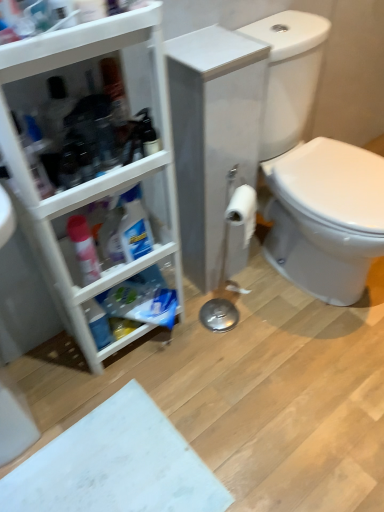
This screenshot has height=512, width=384. What are the coordinates of `translucent plastic spray bottle at left` in the screenshot? It's located at (84, 248).

You are a GUI agent. You are given a task and a screenshot of the screen. Output one action in this format:
    pyautogui.click(x=<x>, y=<y>)
    Task: Click on the white plastic cabinet at left
    
    Given the screenshot: What is the action you would take?
    pyautogui.click(x=93, y=179)

In the scene shown: From the image's perspective, which is below, white plastic cabinet at left or white matte toilet paper at center?

white matte toilet paper at center.

Which object is wider, white plastic cabinet at left or white matte toilet paper at center?

Wider between the two is white plastic cabinet at left.

Considering the sizes of objects white plastic cabinet at left and white matte toilet paper at center in the image provided, who is taller, white plastic cabinet at left or white matte toilet paper at center?

white plastic cabinet at left.

How many degrees apart are the facing directions of white plastic cabinet at left and white matte toilet paper at center?

The angle between the facing direction of white plastic cabinet at left and the facing direction of white matte toilet paper at center is 26.3 degrees.

Find the location of `bathroom cabinet above the white glossy toilet at right (from a real-world perspective)`. bathroom cabinet above the white glossy toilet at right (from a real-world perspective) is located at coordinates (93, 179).

Is white glossy toilet at right positioned far away from white plastic cabinet at left?

That's not correct — white glossy toilet at right is a little close to white plastic cabinet at left.

From the image's perspective, is white glossy toilet at right under white plastic cabinet at left?

No.

Does white glossy toilet at right have a lesser width compared to white plastic cabinet at left?

Incorrect, the width of white glossy toilet at right is not less than that of white plastic cabinet at left.

What are the coordinates of `sit above the white plastic cabinet at left (from the image's perspective)` in the screenshot? It's located at (315, 174).

Which point is more forward, (x=48, y=287) or (x=305, y=61)?

Positioned in front is point (x=48, y=287).

Can you confirm if white plastic cabinet at left is bigger than white glossy toilet at right?

Incorrect, white plastic cabinet at left is not larger than white glossy toilet at right.

Considering the relative positions of white plastic cabinet at left and white glossy toilet at right in the image provided, is white plastic cabinet at left to the left or to the right of white glossy toilet at right?

white plastic cabinet at left is to the left of white glossy toilet at right.

Based on their sizes in the image, would you say translucent plastic spray bottle at left is bigger or smaller than white matte toilet paper at center?

translucent plastic spray bottle at left is smaller than white matte toilet paper at center.

In the image, is translucent plastic spray bottle at left positioned in front of or behind white matte toilet paper at center?

translucent plastic spray bottle at left is in front of white matte toilet paper at center.

Does point (82, 277) appear closer or farther from the camera than point (245, 219)?

Clearly, point (82, 277) is more distant from the camera than point (245, 219).

How much distance is there between translucent plastic spray bottle at left and white matte toilet paper at center?

16.19 inches.

Which object is closer to the camera, white glossy toilet at right or white matte toilet paper at center?

white glossy toilet at right is closer to the camera.

Considering the positions of points (279, 33) and (242, 199), is point (279, 33) closer to camera compared to point (242, 199)?

No, it is not.

Locate an element on the screen. The image size is (384, 512). toilet paper that is behind the white glossy toilet at right is located at coordinates coord(243,211).

Would you say white matte toilet paper at center is part of white glossy toilet at right's contents?

No.

Is translucent plastic spray bottle at left further to camera compared to white glossy toilet at right?

Yes, the depth of translucent plastic spray bottle at left is greater than that of white glossy toilet at right.

Consider the image. Can you confirm if translucent plastic spray bottle at left is positioned to the left of white glossy toilet at right?

Yes, translucent plastic spray bottle at left is to the left of white glossy toilet at right.

Is white glossy toilet at right a part of translucent plastic spray bottle at left?

No, white glossy toilet at right is not surrounded by translucent plastic spray bottle at left.

Are translucent plastic spray bottle at left and white glossy toilet at right making contact?

No.

Who is shorter, translucent plastic spray bottle at left or white plastic cabinet at left?

With less height is translucent plastic spray bottle at left.

Is white plastic cabinet at left surrounded by translucent plastic spray bottle at left?

No, white plastic cabinet at left is not inside translucent plastic spray bottle at left.

Is translucent plastic spray bottle at left looking in the opposite direction of white plastic cabinet at left?

Yes, white plastic cabinet at left is at the back of translucent plastic spray bottle at left.

How far apart are translucent plastic spray bottle at left and white plastic cabinet at left?

translucent plastic spray bottle at left and white plastic cabinet at left are 18.39 centimeters apart.

The height and width of the screenshot is (512, 384). I want to click on toilet paper on the right of the white plastic cabinet at left, so click(x=243, y=211).

Find the location of a particular element. The height and width of the screenshot is (512, 384). bathroom cabinet above the white glossy toilet at right (from a real-world perspective) is located at coordinates (93, 179).

Looking at the image, which one is located further to white matte toilet paper at center, white glossy toilet at right or translucent plastic spray bottle at left?

Among the two, translucent plastic spray bottle at left is located further to white matte toilet paper at center.

From the image, which object appears to be nearer to translucent plastic spray bottle at left, white matte toilet paper at center or white plastic cabinet at left?

The object closer to translucent plastic spray bottle at left is white plastic cabinet at left.

Considering their positions, is white glossy toilet at right positioned further to white plastic cabinet at left than translucent plastic spray bottle at left?

Based on the image, white glossy toilet at right appears to be further to white plastic cabinet at left.

Estimate the real-world distances between objects in this image. Which object is closer to white glossy toilet at right, white plastic cabinet at left or white matte toilet paper at center?

white matte toilet paper at center lies closer to white glossy toilet at right than the other object.

Which object lies further to the anchor point white matte toilet paper at center, translucent plastic spray bottle at left or white glossy toilet at right?

Among the two, translucent plastic spray bottle at left is located further to white matte toilet paper at center.

Estimate the real-world distances between objects in this image. Which object is further from white matte toilet paper at center, translucent plastic spray bottle at left or white plastic cabinet at left?

translucent plastic spray bottle at left is positioned further to the anchor white matte toilet paper at center.

Looking at the image, which one is located further to white plastic cabinet at left, white matte toilet paper at center or translucent plastic spray bottle at left?

Based on the image, white matte toilet paper at center appears to be further to white plastic cabinet at left.

From the image, which object appears to be nearer to translucent plastic spray bottle at left, white glossy toilet at right or white plastic cabinet at left?

white plastic cabinet at left is closer to translucent plastic spray bottle at left.

At what (x,y) coordinates should I click in order to perform the action: click on toilet paper between white plastic cabinet at left and white glossy toilet at right from left to right. Please return your answer as a coordinate pair (x, y). Looking at the image, I should click on (243, 211).

Find the location of a particular element. Image resolution: width=384 pixels, height=512 pixels. cleaning product between white plastic cabinet at left and white matte toilet paper at center from front to back is located at coordinates (84, 248).

Where is `bathroom cabinet between translucent plastic spray bottle at left and white glossy toilet at right in the horizontal direction`? bathroom cabinet between translucent plastic spray bottle at left and white glossy toilet at right in the horizontal direction is located at coordinates (93, 179).

Image resolution: width=384 pixels, height=512 pixels. I want to click on toilet paper between translucent plastic spray bottle at left and white glossy toilet at right in the horizontal direction, so click(x=243, y=211).